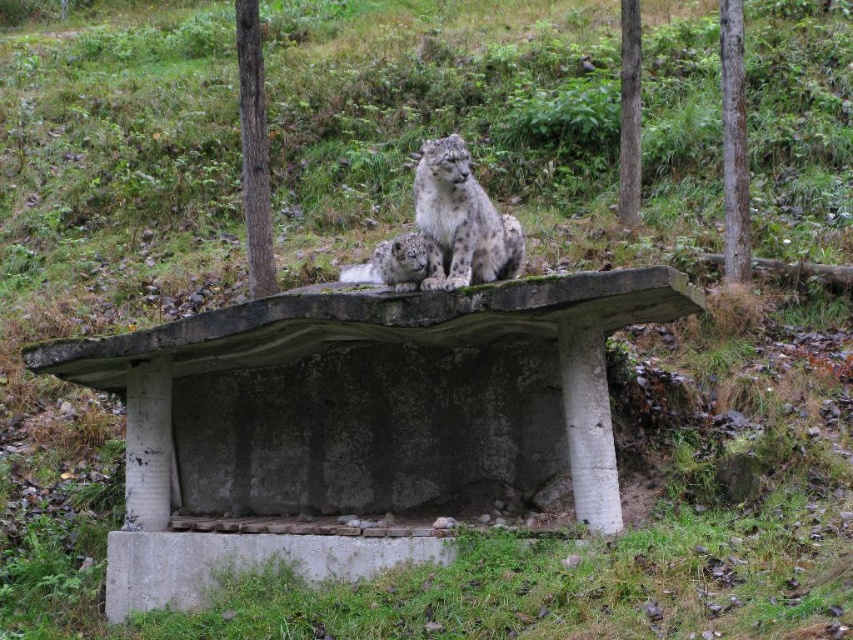
You are a wildlife photographer planning to take a photo of the snow leopards. You notice two trees in the background. Which tree is bigger in size between the smooth brown tree trunk at center and the brown rough bark tree at right?

The smooth brown tree trunk at center is larger in size than the brown rough bark tree at right, so the smooth brown tree trunk at center is bigger.

You are a wildlife photographer aiming to capture a clear photo of the white fur snow leopard at center. You are standing on the concrete bench at center. Can you comfortably take the photo without needing to bend down or adjust your position?

The concrete bench at center is below the white fur snow leopard at center, so standing on the bench would place you at a lower position than the leopard. To take a clear photo without bending down, you might need to adjust your position to be higher or move closer to ensure the leopard is in frame.

You are a wildlife photographer planning to set up a camera trap to capture images of the snow leopards resting on the concrete bench at center. Based on their current positions, where should you place the camera trap to ensure it captures both snow leopards simultaneously?

Since the snow leopards are resting on the concrete bench at center, placing the camera trap at the center position of the concrete bench at center would ensure both are captured in the frame.